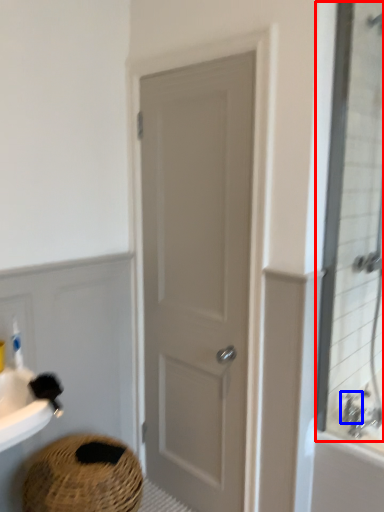
Question: Which point is closer to the camera, mirror (highlighted by a red box) or faucet (highlighted by a blue box)?

Choices:
 (A) mirror
 (B) faucet

Answer: (A)